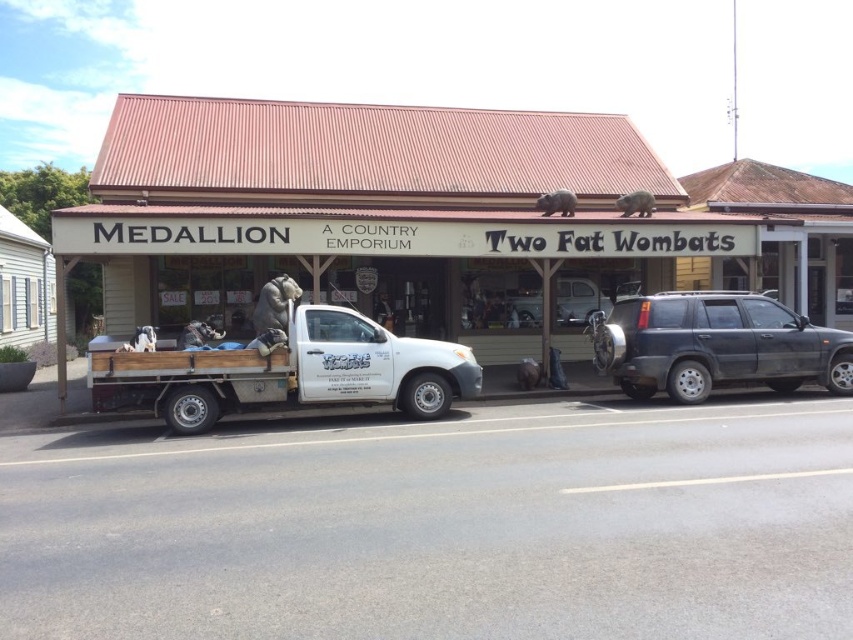
You are standing at the entrance of the storefront and want to move to the white matte truck at lower left. Which direction should you walk to reach it?

Since the white matte truck at lower left is located at point 0.342 on the x axis and 0.509 on the y axis, you should walk towards the lower left direction to reach it.

You are a delivery person who needs to park your vehicle in a narrow alley next to the storefront. The alley can only accommodate vehicles up to the width of the satin silver truck at center. You have a delivery van that is as wide as the white matte truck at lower left. Can your van fit into the alley?

The white matte truck at lower left is wider than the satin silver truck at center. Since the alley can only accommodate vehicles up to the width of the satin silver truck at center, your van, which is as wide as the white matte truck at lower left, cannot fit into the alley.